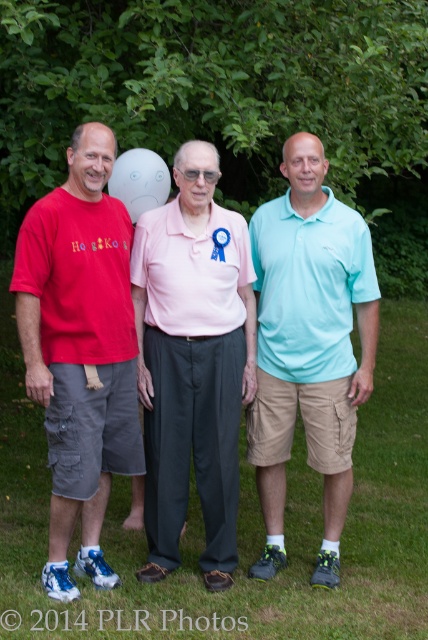
You are a photographer trying to capture a group photo of the matte pink shirt at center and the white matte balloon at center. Based on their heights, which one should you focus on first to ensure proper framing?

The matte pink shirt at center is much taller than the white matte balloon at center, so you should focus on the matte pink shirt at center first to account for its height in the frame.

You are a photographer trying to capture a clear shot of the light blue cotton polo shirt at center and the white matte balloon at center. Given that the balloon is smaller, which object should you focus on first to ensure both are in focus?

The light blue cotton polo shirt at center is larger in size than the white matte balloon at center, so you should focus on the light blue cotton polo shirt at center first since it is larger and will be easier to capture clearly.